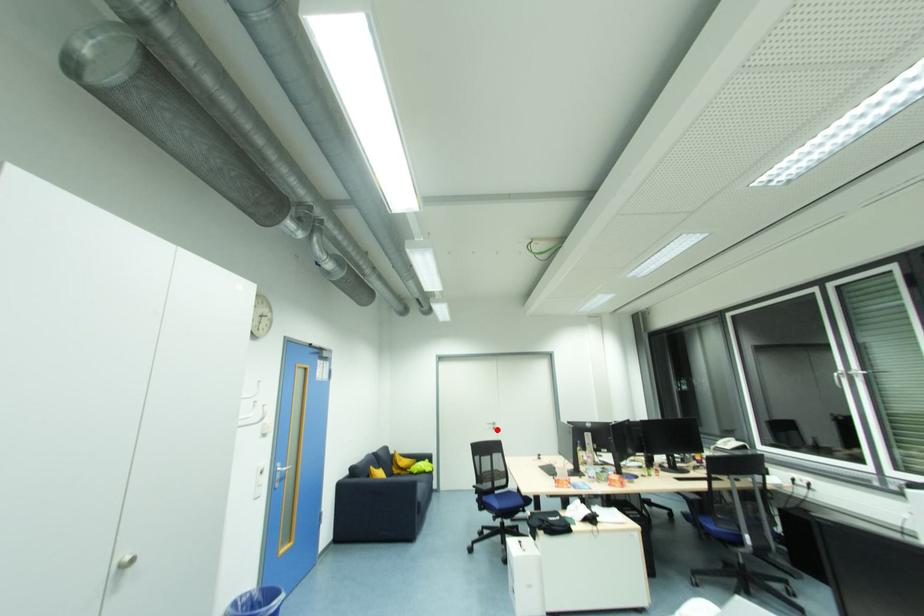
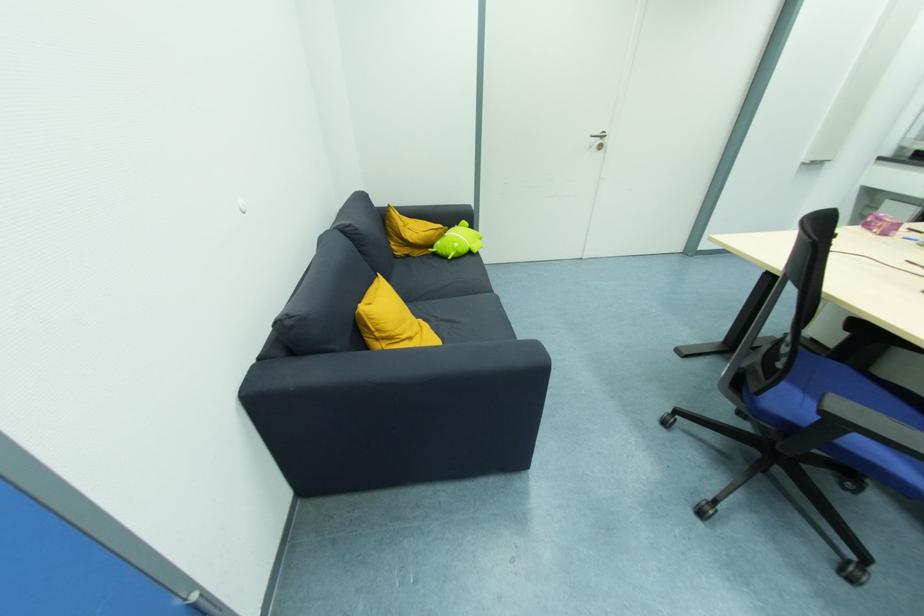
Question: I am providing you with two images of the same scene from different viewpoints. Image1 has a red point marked. In image2, the corresponding 3D location appears at what relative position? Reply with the corresponding letter.

Choices:
 (A) Closer
 (B) Farther

Answer: (A)